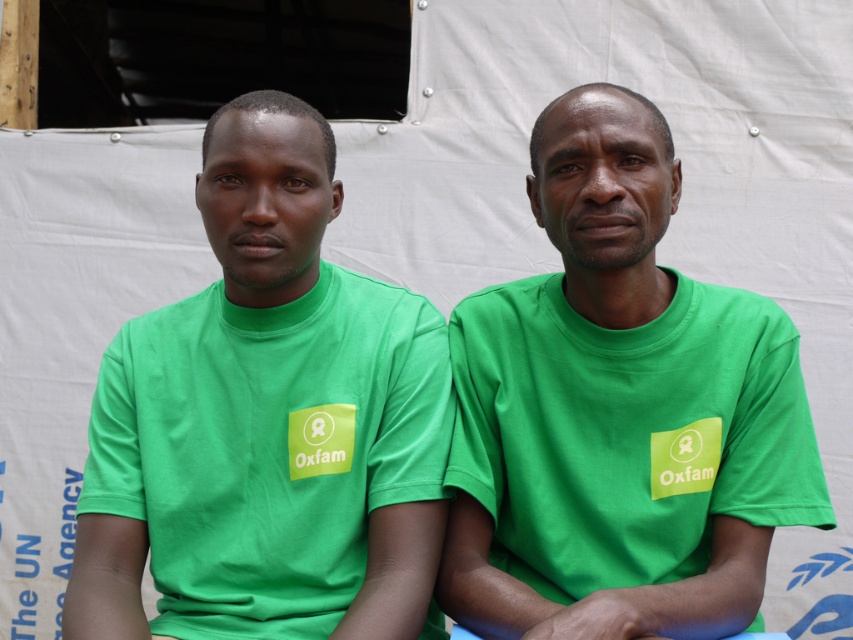
Is point (740, 563) positioned before point (242, 483)?

Yes.

This screenshot has height=640, width=853. What do you see at coordinates (619, 412) in the screenshot? I see `green matte t-shirt at center` at bounding box center [619, 412].

I want to click on green matte t-shirt at center, so click(x=619, y=412).